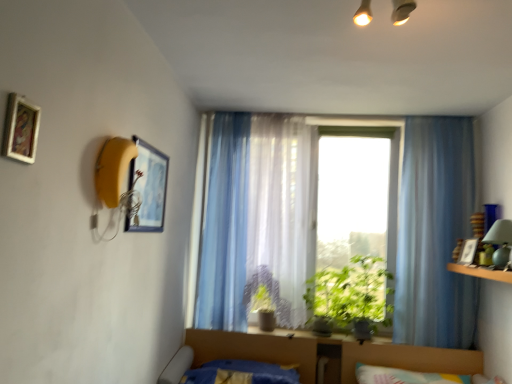
What are the coordinates of `wooden framed painting at upper left, which is the first picture frame from front to back` in the screenshot? It's located at tap(21, 129).

You are a GUI agent. You are given a task and a screenshot of the screen. Output one action in this format:
    pyautogui.click(x=<x>, y=<y>)
    Task: Click on the matte black picture frame at upper left, the 2th picture frame from the right
    
    Given the screenshot: What is the action you would take?
    pyautogui.click(x=148, y=188)

This screenshot has height=384, width=512. I want to click on green glass lamp at right, so click(x=500, y=242).

Locate an element on the screen. The width and height of the screenshot is (512, 384). blue plush bed at lower center is located at coordinates (224, 371).

What do you see at coordinates (468, 251) in the screenshot? I see `white matte picture frame at right, the third picture frame positioned from the front` at bounding box center [468, 251].

Where is `wooden framed painting at upper left, which is counted as the third picture frame, starting from the right`? The image size is (512, 384). wooden framed painting at upper left, which is counted as the third picture frame, starting from the right is located at coordinates (21, 129).

Which is in front, point (271, 300) or point (4, 142)?

The point (4, 142) is closer.

Is green matte plant at center, which is the 1th plant from left to right, at the left side of wooden framed painting at upper left, the 1th picture frame positioned from the left?

Incorrect, green matte plant at center, which is the 1th plant from left to right, is not on the left side of wooden framed painting at upper left, the 1th picture frame positioned from the left.

There is a green matte plant at center, which is the 1th plant from left to right. At what (x,y) coordinates should I click in order to perform the action: click on the 3rd picture frame above it (from a real-world perspective). Please return your answer as a coordinate pair (x, y). This screenshot has width=512, height=384. Looking at the image, I should click on (21, 129).

Measure the distance from wooden shelf at right to white matte picture frame at right, which is the first picture frame in bottom-to-top order.

wooden shelf at right and white matte picture frame at right, which is the first picture frame in bottom-to-top order, are 4.18 inches apart.

What's the angular difference between wooden shelf at right and white matte picture frame at right, which is the first picture frame in bottom-to-top order,'s facing directions?

23.8 degrees separate the facing orientations of wooden shelf at right and white matte picture frame at right, which is the first picture frame in bottom-to-top order.

Relative to white matte picture frame at right, the 3th picture frame from the left, is wooden shelf at right in front or behind?

In the image, wooden shelf at right appears in front of white matte picture frame at right, the 3th picture frame from the left.

From a real-world perspective, starting from the wooden shelf at right, which picture frame is the 1st one vertically above it? Please provide its 2D coordinates.

[(468, 251)]

Can you tell me how much translucent fabric curtain at center, which is the 2th curtain from left to right, and green leafy plant at center differ in facing direction?

The facing directions of translucent fabric curtain at center, which is the 2th curtain from left to right, and green leafy plant at center are 0.586 degrees apart.

From the picture: Which is more to the right, translucent fabric curtain at center, acting as the 2th curtain starting from the right, or green leafy plant at center?

green leafy plant at center.

Looking at the image, does translucent fabric curtain at center, which is the 2th curtain from left to right, seem bigger or smaller compared to green leafy plant at center?

Considering their sizes, translucent fabric curtain at center, which is the 2th curtain from left to right, takes up more space than green leafy plant at center.

In the scene shown: Is translucent fabric curtain at center, acting as the 2th curtain starting from the right, outside of green leafy plant at center?

Yes, translucent fabric curtain at center, acting as the 2th curtain starting from the right, is outside of green leafy plant at center.

Could you tell me if translucent fabric curtain at center, acting as the 2th curtain starting from the right, is turned towards blue sheer curtain at center, the 1th curtain when ordered from right to left?

No, translucent fabric curtain at center, acting as the 2th curtain starting from the right, is not oriented towards blue sheer curtain at center, the 1th curtain when ordered from right to left.

Is the position of translucent fabric curtain at center, acting as the 2th curtain starting from the right, less distant than that of blue sheer curtain at center, the 3th curtain positioned from the left?

No, the depth of translucent fabric curtain at center, acting as the 2th curtain starting from the right, is greater than that of blue sheer curtain at center, the 3th curtain positioned from the left.

Is translucent fabric curtain at center, which is the 2th curtain from left to right, inside the boundaries of blue sheer curtain at center, the 1th curtain when ordered from right to left, or outside?

The correct answer is: outside.

From a real-world perspective, between translucent fabric curtain at center, acting as the 2th curtain starting from the right, and blue sheer curtain at center, the 1th curtain when ordered from right to left, who is vertically higher?

From a 3D spatial view, translucent fabric curtain at center, acting as the 2th curtain starting from the right, is above.

From the image's perspective, which one is positioned higher, green matte plant at center, which is the 1th plant from left to right, or blue plush bed at lower center?

green matte plant at center, which is the 1th plant from left to right, is shown above in the image.

Can you confirm if green matte plant at center, which is the 1th plant from left to right, is positioned to the right of blue plush bed at lower center?

Yes, green matte plant at center, which is the 1th plant from left to right, is to the right of blue plush bed at lower center.

Does green matte plant at center, which is the 1th plant from left to right, have a larger size compared to blue plush bed at lower center?

No.

Is green matte plant at center, which is the 1th plant from left to right, closer to the viewer compared to blue plush bed at lower center?

No.

Can you confirm if wooden shelf at right is shorter than green glass lamp at right?

Indeed, wooden shelf at right has a lesser height compared to green glass lamp at right.

From a real-world perspective, is wooden shelf at right located beneath green glass lamp at right?

Yes, from a real-world perspective, wooden shelf at right is below green glass lamp at right.

There is a wooden shelf at right. Identify the location of lamp above it (from a real-world perspective). The width and height of the screenshot is (512, 384). (500, 242).

From a real-world perspective, is white matte picture frame at right, which is the third picture frame in top-to-bottom order, over wooden framed painting at upper left, acting as the 1th picture frame starting from the top?

No, from a real-world perspective, white matte picture frame at right, which is the third picture frame in top-to-bottom order, is not above wooden framed painting at upper left, acting as the 1th picture frame starting from the top.

Would you consider white matte picture frame at right, the first picture frame viewed from the back, to be distant from wooden framed painting at upper left, acting as the 1th picture frame starting from the top?

white matte picture frame at right, the first picture frame viewed from the back, is positioned a significant distance from wooden framed painting at upper left, acting as the 1th picture frame starting from the top.

Is white matte picture frame at right, which is the third picture frame in top-to-bottom order, taller or shorter than wooden framed painting at upper left, placed as the 3th picture frame when sorted from back to front?

In the image, white matte picture frame at right, which is the third picture frame in top-to-bottom order, appears to be taller than wooden framed painting at upper left, placed as the 3th picture frame when sorted from back to front.

From the green matte plant at center, marked as the second plant in a right-to-left arrangement, count 3rd picture frames forward and point to it. Please provide its 2D coordinates.

[(21, 129)]

Locate an element on the screen. Image resolution: width=512 pixels, height=384 pixels. picture frame behind the wooden shelf at right is located at coordinates (468, 251).

Based on the photo, which object lies nearer to the anchor point translucent fabric window at center, wooden shelf at right or blue plush bed at lower center?

wooden shelf at right is positioned closer to the anchor translucent fabric window at center.

Considering their positions, is green matte plant at center, marked as the second plant in a right-to-left arrangement, positioned further to green leafy plant at center, placed as the 2th plant when sorted from left to right, than blue sheer curtain at center, the 3th curtain positioned from the left?

blue sheer curtain at center, the 3th curtain positioned from the left, is positioned further to the anchor green leafy plant at center, placed as the 2th plant when sorted from left to right.

When comparing their distances from green matte plant at center, which is the 1th plant from left to right, does wooden framed painting at upper left, which is the first picture frame from front to back, or matte black picture frame at upper left, the second picture frame when ordered from top to bottom, seem further?

wooden framed painting at upper left, which is the first picture frame from front to back, is further to green matte plant at center, which is the 1th plant from left to right.

Estimate the real-world distances between objects in this image. Which object is further from matte black picture frame at upper left, the 2th picture frame from the back, translucent fabric curtain at center, which is the 2th curtain from left to right, or translucent fabric window at center?

Based on the image, translucent fabric window at center appears to be further to matte black picture frame at upper left, the 2th picture frame from the back.

Considering their positions, is translucent fabric curtain at center, which is the 2th curtain from left to right, positioned further to wooden shelf at right than green glass lamp at right?

Among the two, translucent fabric curtain at center, which is the 2th curtain from left to right, is located further to wooden shelf at right.

Looking at the image, which one is located further to wooden shelf at right, matte black picture frame at upper left, the 2th picture frame from the front, or translucent fabric window at center?

matte black picture frame at upper left, the 2th picture frame from the front, is positioned further to the anchor wooden shelf at right.

Considering their positions, is translucent fabric curtain at center, acting as the 2th curtain starting from the right, positioned further to translucent fabric window at center than wooden shelf at right?

Among the two, translucent fabric curtain at center, acting as the 2th curtain starting from the right, is located further to translucent fabric window at center.

Considering their positions, is white matte picture frame at right, the 3th picture frame from the left, positioned closer to green leafy plant at center, placed as the 2th plant when sorted from left to right, than translucent fabric curtain at center, acting as the 2th curtain starting from the right?

The object closer to green leafy plant at center, placed as the 2th plant when sorted from left to right, is translucent fabric curtain at center, acting as the 2th curtain starting from the right.

Locate an element on the screen. lamp between wooden shelf at right and blue sheer curtain at center, the 1th curtain when ordered from right to left, from front to back is located at coordinates (500, 242).

At what (x,y) coordinates should I click in order to perform the action: click on picture frame between matte black picture frame at upper left, arranged as the 2th picture frame when viewed from the left, and green glass lamp at right. Please return your answer as a coordinate pair (x, y). This screenshot has width=512, height=384. Looking at the image, I should click on (468, 251).

The image size is (512, 384). Identify the location of vegetation between blue plush bed at lower center and blue sheer curtain at center, the 1th curtain when ordered from right to left. (351, 294).

Find the location of a particular element. vegetation situated between blue plush bed at lower center and wooden shelf at right from left to right is located at coordinates (351, 294).